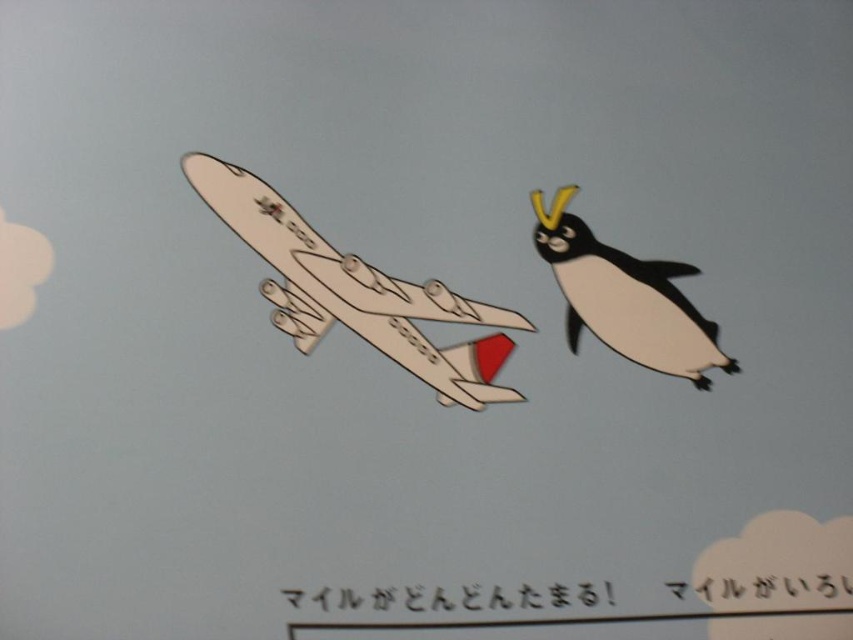
You are an observer looking at the image. Which object is positioned closer to you between the white cardboard airplane at center and the white paper penguin at right?

The white cardboard airplane at center is closer to the viewer than the white paper penguin at right.

Where is the white cardboard airplane at center located in the image?

The white cardboard airplane at center is located at point (x=355, y=291) in the image.